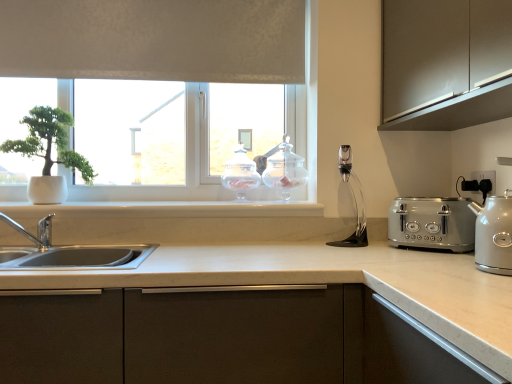
Question: In terms of size, does white plastic electric outlet at right appear bigger or smaller than clear glass jar at center, arranged as the second appliance when viewed from the right?

Choices:
 (A) small
 (B) big

Answer: (A)

Question: Visually, is white plastic electric outlet at right positioned to the left or to the right of clear glass jar at center, arranged as the second appliance when viewed from the right?

Choices:
 (A) right
 (B) left

Answer: (A)

Question: Which is nearer to the white matte pot at left?

Choices:
 (A) clear glass jar at upper center, marked as the 1th appliance in a right-to-left arrangement
 (B) white plastic electric outlet at right
 (C) white matte window at upper center
 (D) satin silver toaster at right
 (E) matte brown cabinet at upper right

Answer: (C)

Question: Based on their relative distances, which object is farther from the clear glass jar at upper center, marked as the 1th appliance in a right-to-left arrangement?

Choices:
 (A) satin silver kettle at right
 (B) white matte pot at left
 (C) white marble window sill at center
 (D) satin silver toaster at right
 (E) clear glass jar at center, arranged as the second appliance when viewed from the right

Answer: (A)